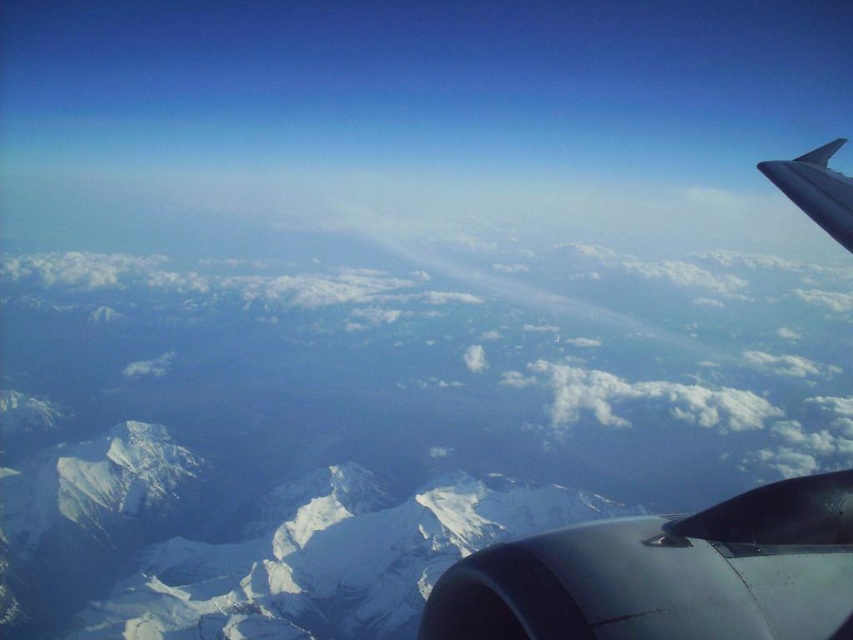
You are a passenger sitting near the window of the airplane. You notice two points outside the window at coordinates point (x=775, y=518) and point (x=820, y=211). Which point is closer to your line of sight?

Point (x=775, y=518) is in front of point (x=820, y=211), so it is closer to your line of sight.

From the picture: You are a passenger on an airplane and looking out the window. You see a point marked at coordinates (x=241, y=544). Based on the scene, where is this point located?

The point at (x=241, y=544) is located on the white snow covered mountain range at center.

You are a pilot checking the position of the metallic gray engine at right for maintenance. According to the aircraft manual, the engine should be located at point 0.898, 0.783. Is the engine positioned correctly?

Yes, the metallic gray engine at right is positioned at point (666, 573), so it is correctly placed according to the manual.